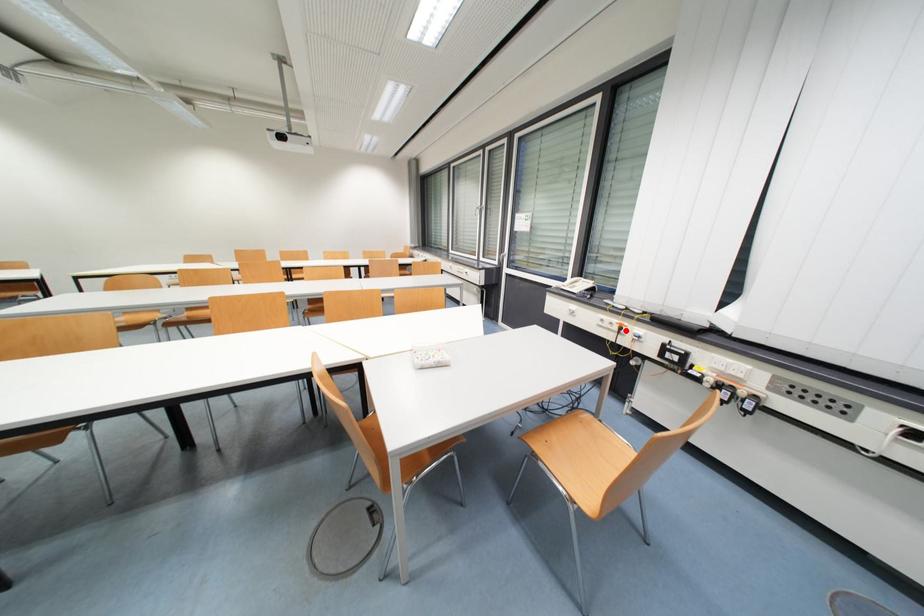
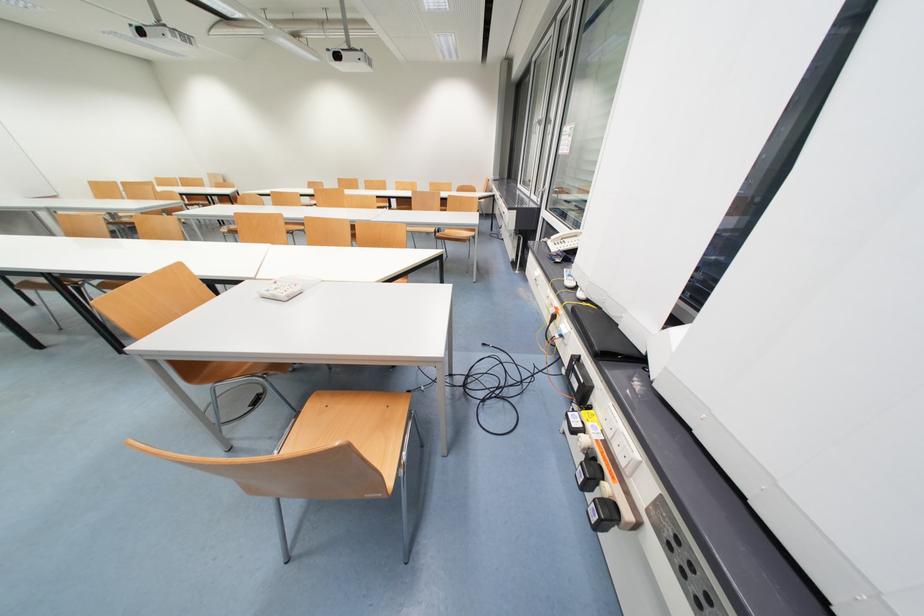
In the second image, find the point that corresponds to the highlighted location in the first image.

(560, 318)